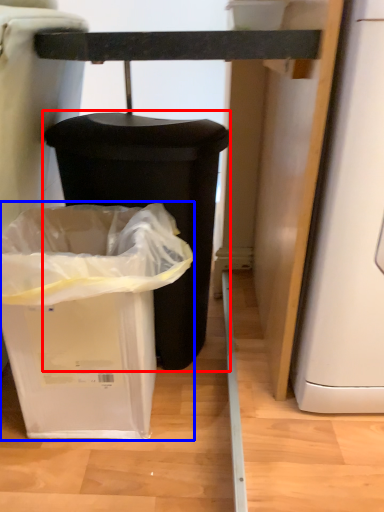
Question: Which of the following is the closest to the observer, waste container (highlighted by a red box) or waste container (highlighted by a blue box)?

Choices:
 (A) waste container
 (B) waste container

Answer: (B)